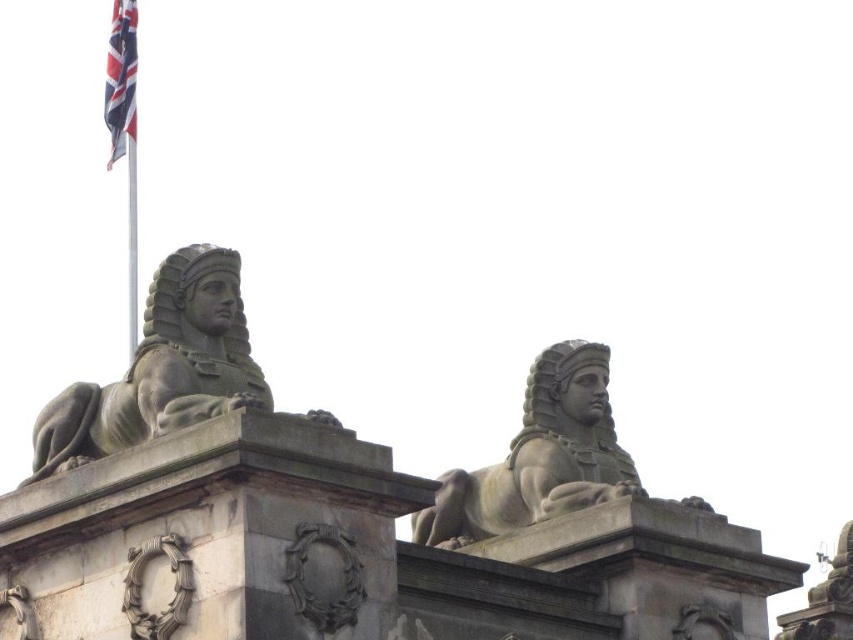
You are an archaeologist examining two objects at the upper left of the image. You have the matte stone sphinx at upper left and the union jack fabric at upper left. Which object is taller?

The union jack fabric at upper left is taller than the matte stone sphinx at upper left.

You are an archaeologist examining the image of two sphinx statues and a carved stone wreath. The scene shows the matte stone sphinx at upper left and the carved stone wreath at center. Based on their sizes, which object would cast a longer shadow if the sun is directly overhead?

The matte stone sphinx at upper left is wider than the carved stone wreath at center, so it would cast a longer shadow when the sun is directly overhead.

You are a historian examining the image of the sphinx statues. You notice a carved stone wreath at center and a union jack fabric at upper left. Based on their positions, which object is closer to the viewer?

The carved stone wreath at center is closer to the viewer than the union jack fabric at upper left because objects closer to the viewer are typically positioned lower in the image, and the wreath is at the center while the fabric is at the upper left.